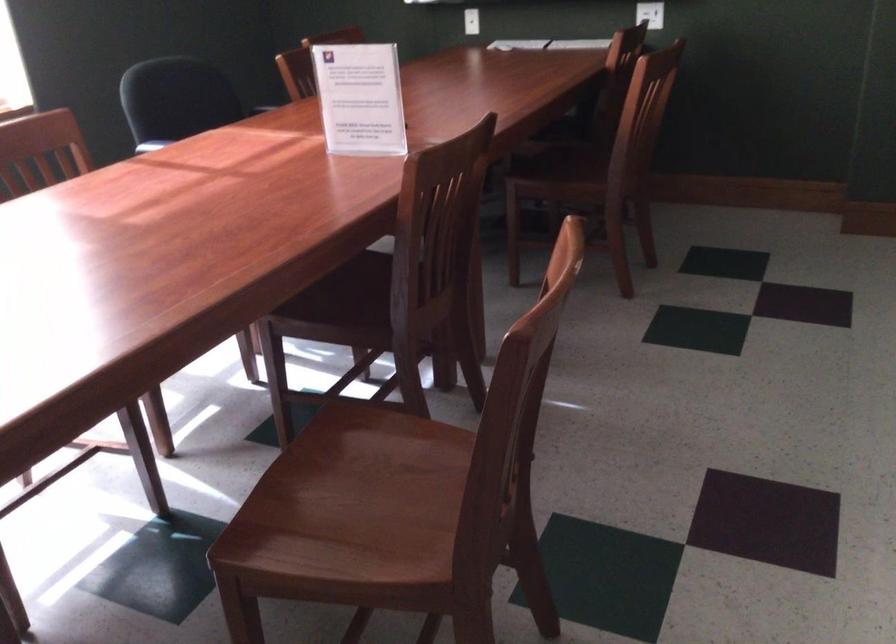
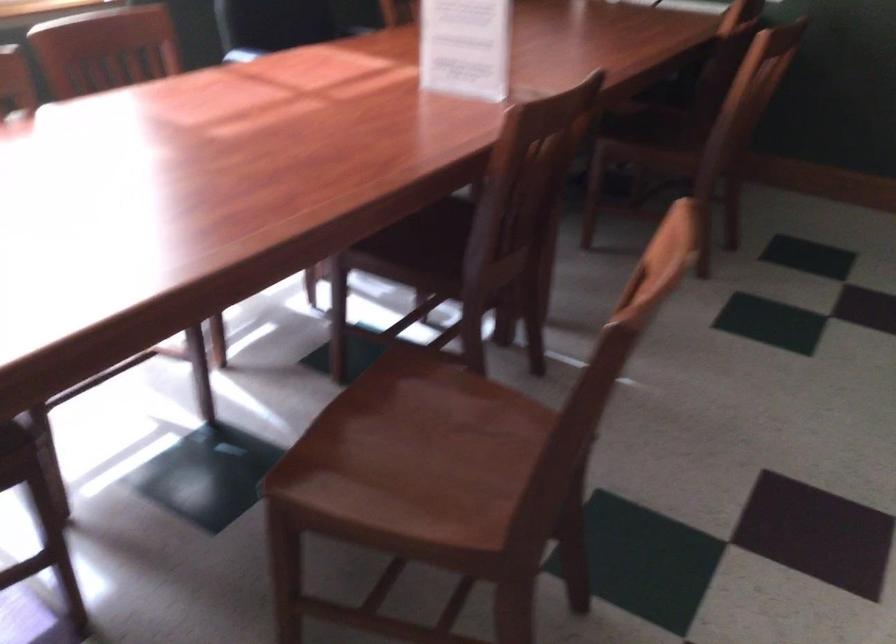
Question: Based on the continuous images, in which direction is the camera rotating? Reply with the corresponding letter.

Choices:
 (A) Left
 (B) Right
 (C) Up
 (D) Down

Answer: (D)